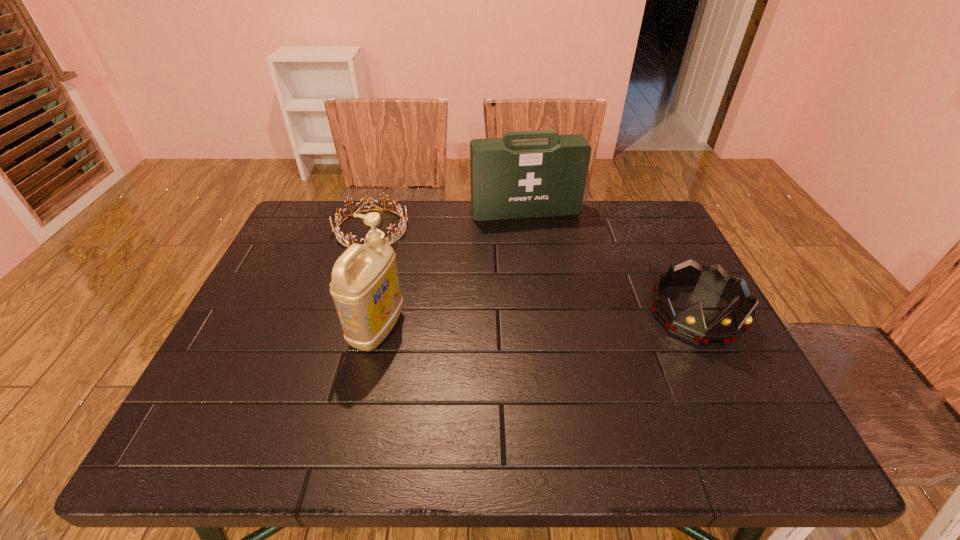
Where is `vacant space located 0.170m on the front-facing side of the second object from right to left`? vacant space located 0.170m on the front-facing side of the second object from right to left is located at coordinates point(544,256).

The height and width of the screenshot is (540, 960). I want to click on free space located on the front-facing side of the farther tiara, so click(x=471, y=300).

Locate an element on the screen. free spot located 0.390m on the front-facing side of the farther tiara is located at coordinates (492, 315).

Locate an element on the screen. vacant space located on the front-facing side of the farther tiara is located at coordinates (416, 260).

Where is `the first-aid kit that is at the far edge`? the first-aid kit that is at the far edge is located at coordinates (510, 179).

Where is `tiara located in the far edge section of the desktop`? tiara located in the far edge section of the desktop is located at coordinates (402, 220).

The height and width of the screenshot is (540, 960). What are the coordinates of `object that is positioned at the left edge` in the screenshot? It's located at (402, 220).

Identify the location of object positioned at the right edge. (689, 324).

The width and height of the screenshot is (960, 540). Identify the location of object that is positioned at the far left corner. (402, 220).

This screenshot has height=540, width=960. In the image, there is a desktop. Find the location of `free space at the far edge`. free space at the far edge is located at coordinates (565, 232).